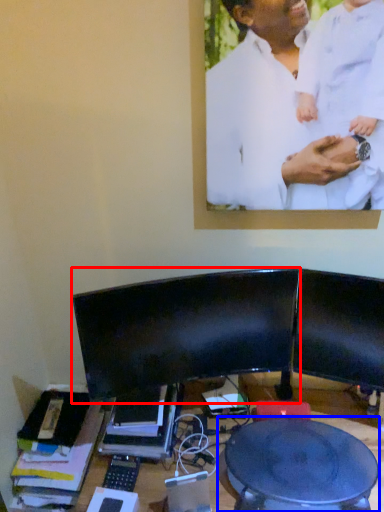
Question: Which point is further to the camera, computer monitor (highlighted by a red box) or round table (highlighted by a blue box)?

Choices:
 (A) computer monitor
 (B) round table

Answer: (A)